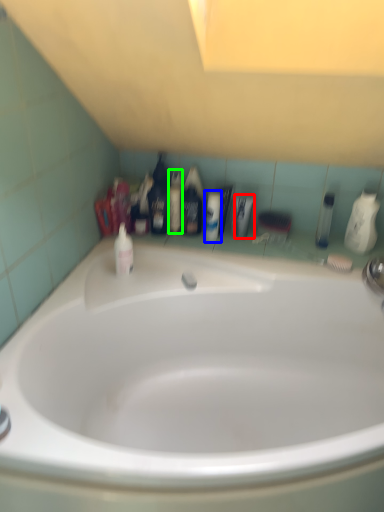
Question: Estimate the real-world distances between objects in this image. Which object is farther from toiletry (highlighted by a red box), toiletry (highlighted by a blue box) or mouthwash (highlighted by a green box)?

Choices:
 (A) toiletry
 (B) mouthwash

Answer: (B)